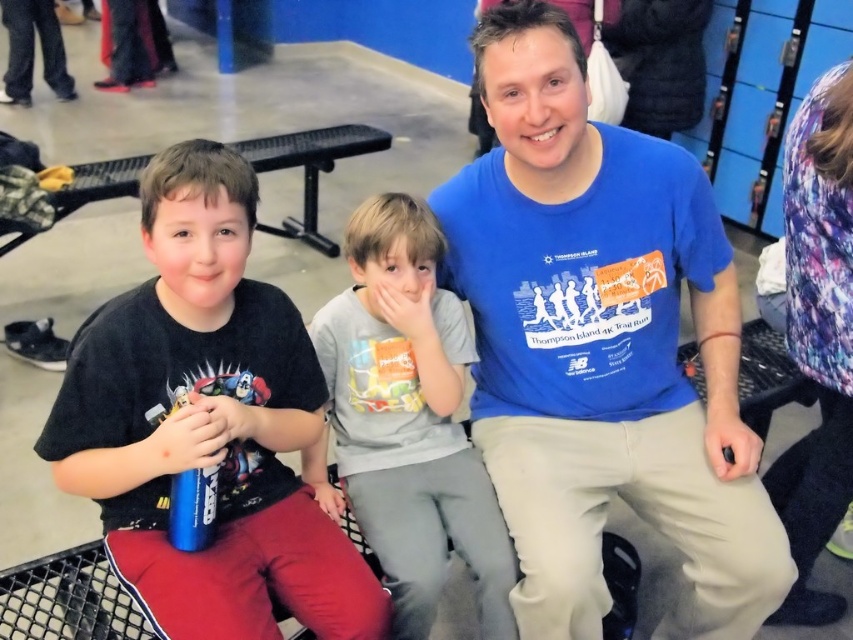
You are a photographer positioned in front of the black metal bench where the two boys are sitting. You want to capture a photo that includes both the black matte shirt at left and the gray cotton shirt at center. Based on their positions, which shirt should appear higher in the photo?

The black matte shirt at left should appear higher in the photo because it is positioned above the gray cotton shirt at center.

What is located at the coordinates point (601, 346)?

The blue cotton t shirt at center is located at point (601, 346).